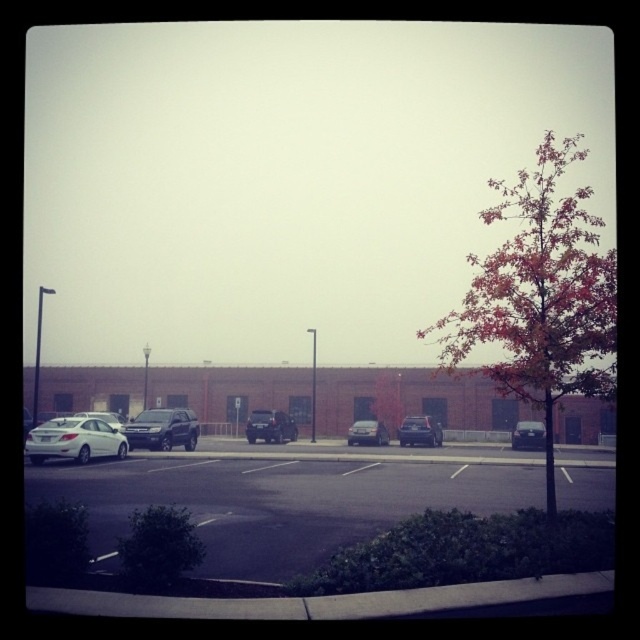
Between point (529, 435) and point (92, 417), which one is positioned in front?

Point (529, 435)

Is satin black sedan at center bigger than silver metallic sedan at left?

Actually, satin black sedan at center might be smaller than silver metallic sedan at left.

What do you see at coordinates (529, 435) in the screenshot? I see `satin black sedan at center` at bounding box center [529, 435].

Image resolution: width=640 pixels, height=640 pixels. Identify the location of satin black sedan at center. (529, 435).

Which of these two, dark gray asphalt parking lot at lower left or shiny black sedan at center, stands taller?

dark gray asphalt parking lot at lower left

Between dark gray asphalt parking lot at lower left and shiny black sedan at center, which one appears on the right side from the viewer's perspective?

shiny black sedan at center

Describe the element at coordinates (285, 497) in the screenshot. I see `dark gray asphalt parking lot at lower left` at that location.

You are a GUI agent. You are given a task and a screenshot of the screen. Output one action in this format:
    pyautogui.click(x=<x>, y=<y>)
    Task: Click on the dark gray asphalt parking lot at lower left
    The width and height of the screenshot is (640, 640).
    Given the screenshot: What is the action you would take?
    pyautogui.click(x=285, y=497)

Is point (193, 433) closer to camera compared to point (248, 419)?

Yes, point (193, 433) is in front of point (248, 419).

Is shiny black suv at center taller than matte black suv at center?

Incorrect, shiny black suv at center's height is not larger of matte black suv at center's.

Between point (177, 426) and point (268, 410), which one is positioned in front?

Positioned in front is point (177, 426).

Locate an element on the screen. The image size is (640, 640). shiny black suv at center is located at coordinates [163, 429].